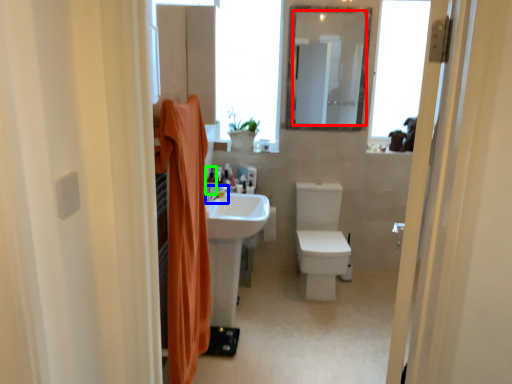
Question: Which object is the closest to the mirror (highlighted by a red box)? Choose among these: tap (highlighted by a blue box) or toiletry (highlighted by a green box).

Choices:
 (A) tap
 (B) toiletry

Answer: (B)